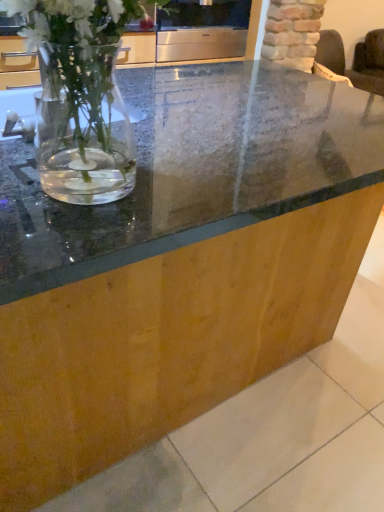
Question: Is dark brown fabric armchair at upper right outside satin silver oven at upper center?

Choices:
 (A) yes
 (B) no

Answer: (A)

Question: Is dark brown fabric armchair at upper right looking in the opposite direction of satin silver oven at upper center?

Choices:
 (A) no
 (B) yes

Answer: (A)

Question: From a real-world perspective, is dark brown fabric armchair at upper right over satin silver oven at upper center?

Choices:
 (A) no
 (B) yes

Answer: (A)

Question: Is dark brown fabric armchair at upper right closer to the viewer compared to satin silver oven at upper center?

Choices:
 (A) no
 (B) yes

Answer: (A)

Question: Considering the relative positions of dark brown fabric armchair at upper right and satin silver oven at upper center in the image provided, is dark brown fabric armchair at upper right to the left of satin silver oven at upper center from the viewer's perspective?

Choices:
 (A) no
 (B) yes

Answer: (A)

Question: Does dark brown fabric armchair at upper right have a larger size compared to satin silver oven at upper center?

Choices:
 (A) no
 (B) yes

Answer: (B)

Question: Is the depth of satin silver oven at upper center greater than that of dark brown fabric armchair at upper right?

Choices:
 (A) no
 (B) yes

Answer: (A)

Question: Is satin silver oven at upper center aimed at dark brown fabric armchair at upper right?

Choices:
 (A) yes
 (B) no

Answer: (B)

Question: Are satin silver oven at upper center and dark brown fabric armchair at upper right far apart?

Choices:
 (A) no
 (B) yes

Answer: (B)

Question: From the image's perspective, is satin silver oven at upper center on dark brown fabric armchair at upper right?

Choices:
 (A) no
 (B) yes

Answer: (A)

Question: Would you say satin silver oven at upper center is outside dark brown fabric armchair at upper right?

Choices:
 (A) yes
 (B) no

Answer: (A)

Question: Can you confirm if satin silver oven at upper center is positioned to the right of dark brown fabric armchair at upper right?

Choices:
 (A) yes
 (B) no

Answer: (B)

Question: Considering the positions of dark brown fabric armchair at upper right and satin silver oven at upper center in the image, is dark brown fabric armchair at upper right bigger or smaller than satin silver oven at upper center?

Choices:
 (A) big
 (B) small

Answer: (A)